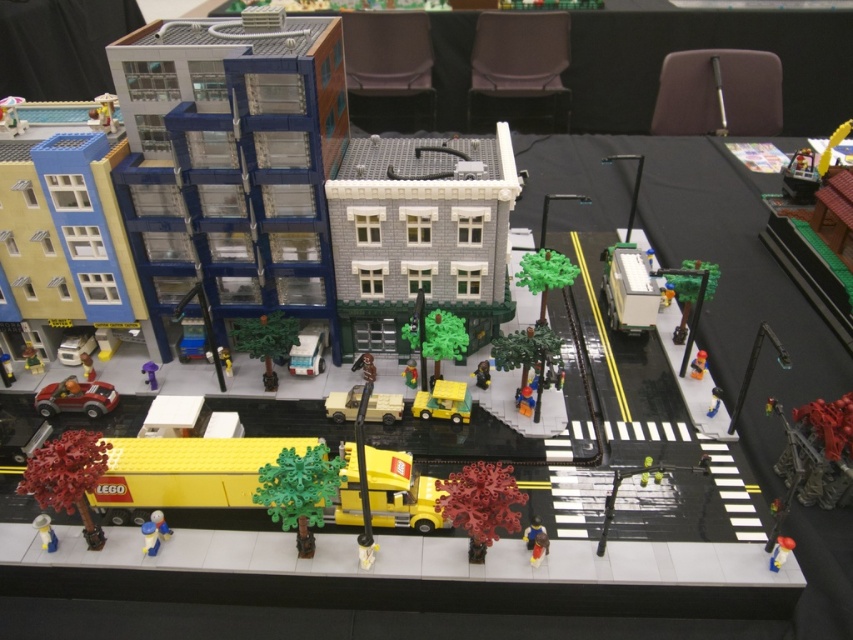
Question: Which object is the farthest from the purple plastic toy at lower left?

Choices:
 (A) smooth plastic toy at center
 (B) blue plastic figure at lower left
 (C) yellow matte car at center
 (D) yellow plastic house at upper right

Answer: (D)

Question: Is brick red tree at lower left wider than translucent plastic figure at lower left?

Choices:
 (A) yes
 (B) no

Answer: (A)

Question: Estimate the real-world distances between objects in this image. Which object is closer to the smooth red toy at lower right?

Choices:
 (A) translucent plastic minifigure at center
 (B) brick red tree at lower left
 (C) purple plastic toy at lower left
 (D) yellow plastic truck at lower left

Answer: (A)

Question: Which object is positioned farthest from the brick red tree at lower left?

Choices:
 (A) yellow plastic truck at lower left
 (B) rubberized red tree at center
 (C) smooth red toy at lower right

Answer: (C)

Question: Can you confirm if yellow plastic house at upper right is positioned to the right of smooth red toy at lower right?

Choices:
 (A) yes
 (B) no

Answer: (A)

Question: Is brick red tree at lower left below yellow plastic truck at lower left?

Choices:
 (A) yes
 (B) no

Answer: (A)